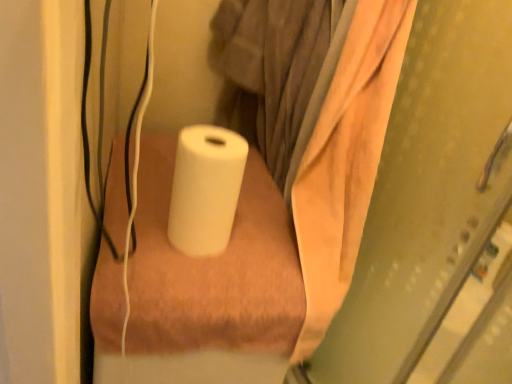
Locate an element on the screen. This screenshot has height=384, width=512. free space to the left of white matte paper towel at center is located at coordinates (138, 215).